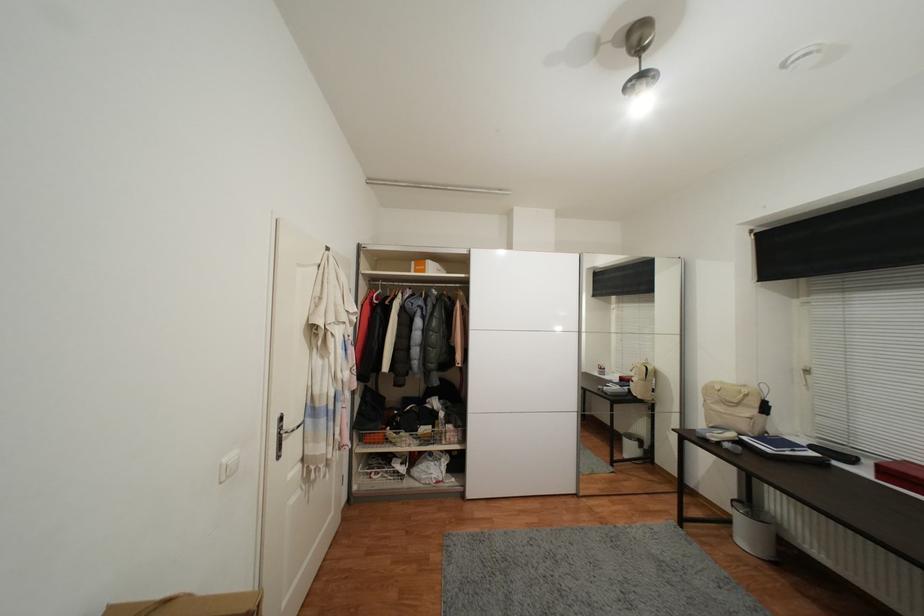
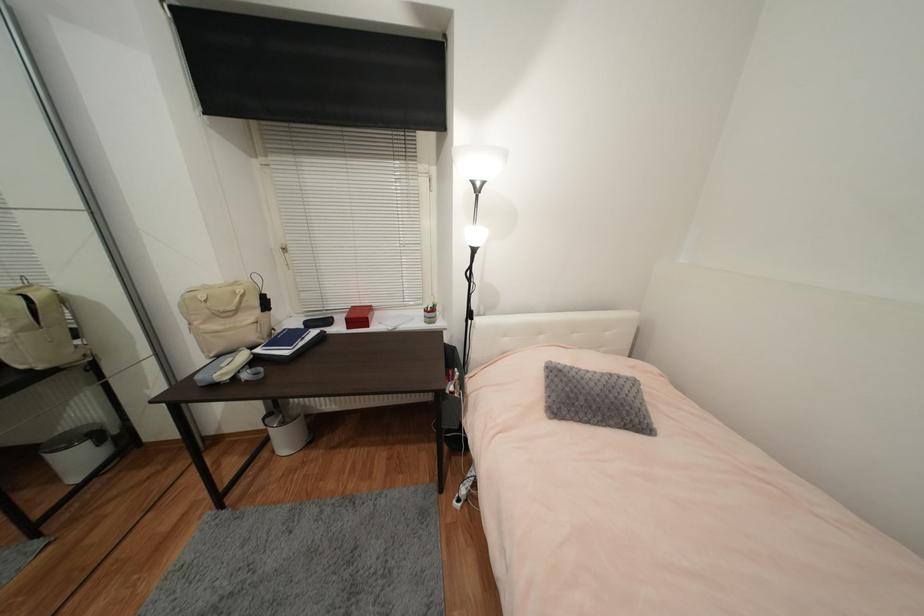
The point at (636, 450) is marked in the first image. Where is the corresponding point in the second image?

(83, 462)